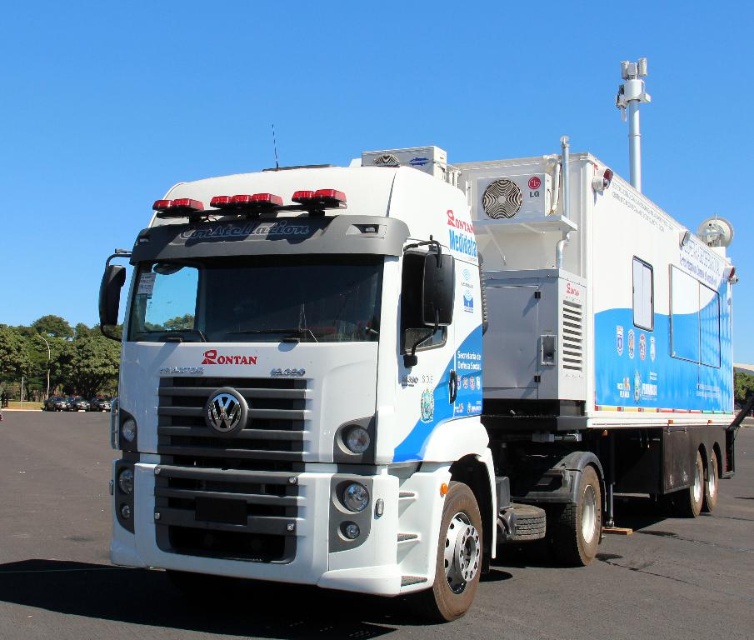
Is point (608, 486) less distant than point (394, 621)?

No, it is not.

This screenshot has width=754, height=640. In order to click on white glossy trailer truck at center in this screenshot , I will do `click(411, 371)`.